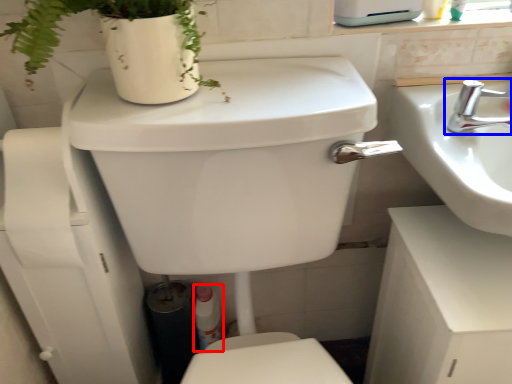
Question: Which of the following is the farthest to the observer, toiletry (highlighted by a red box) or tap (highlighted by a blue box)?

Choices:
 (A) toiletry
 (B) tap

Answer: (A)